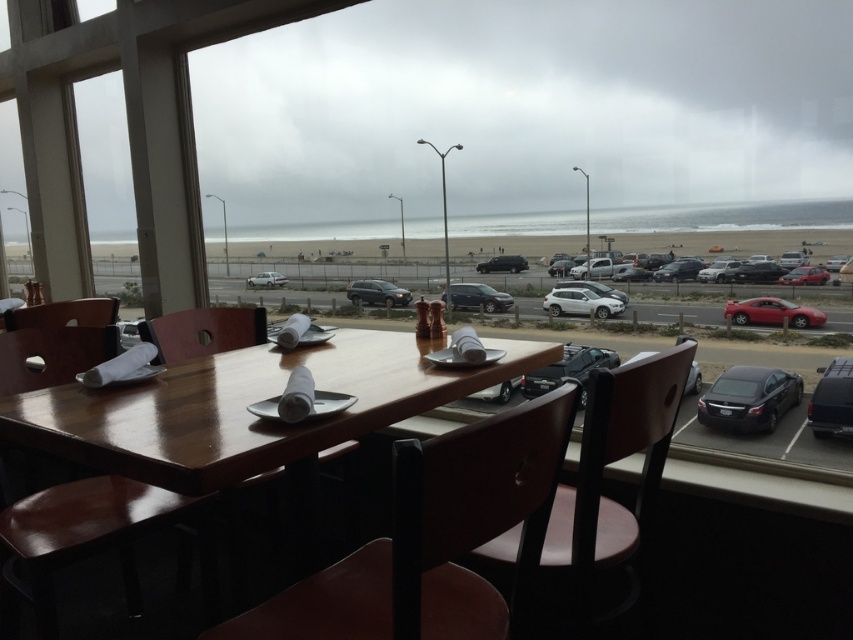
Question: Is black matte van at lower right above satin silver suv at center?

Choices:
 (A) no
 (B) yes

Answer: (A)

Question: Does glossy red car at right come behind matte black suv at center?

Choices:
 (A) yes
 (B) no

Answer: (B)

Question: Which object is closer to the camera taking this photo?

Choices:
 (A) shiny black sedan at center
 (B) transparent glass window at upper left
 (C) wooden chair at center

Answer: (C)

Question: Can you confirm if transparent glass window at upper left is positioned above satin silver suv at center?

Choices:
 (A) no
 (B) yes

Answer: (B)

Question: Among these objects, which one is nearest to the camera?

Choices:
 (A) shiny red sedan at center
 (B) wooden chair at center
 (C) brown wood chair at lower left

Answer: (A)

Question: Which object appears farthest from the camera in this image?

Choices:
 (A) glossy red car at right
 (B) brown wood chair at lower right
 (C) shiny black car at center

Answer: (C)